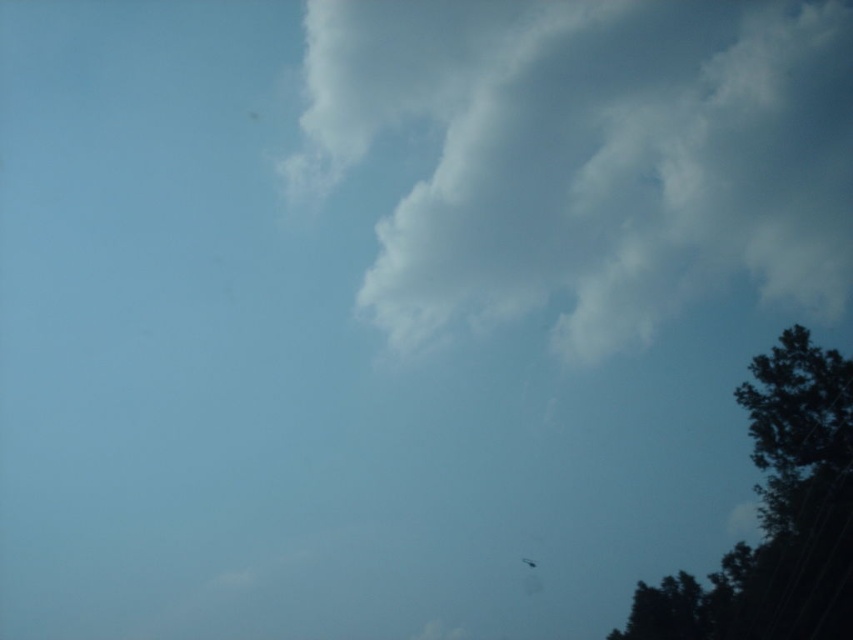
You are an airplane pilot flying through the sky. You notice the white fluffy cloud at upper center and the translucent white fly at lower right. Which object is wider from your current viewpoint?

The white fluffy cloud at upper center might be wider than the translucent white fly at lower right according to the description.

In the scene shown: You are an airplane pilot flying at an altitude where you can see the white fluffy cloud at upper center and the translucent white fly at lower right. Which object would block your view if you try to look through them towards the ground?

The white fluffy cloud at upper center would block your view first because it is in front of the translucent white fly at lower right.